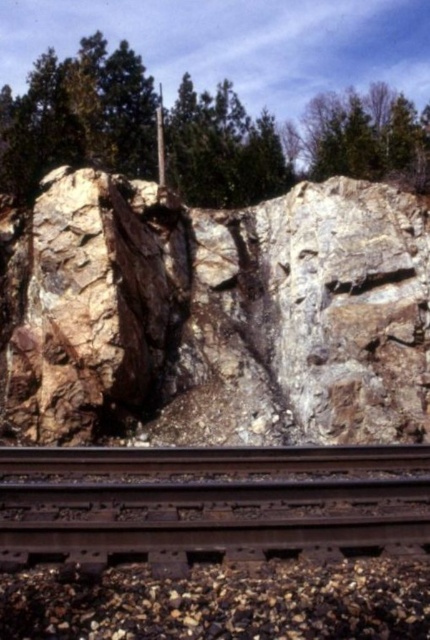
Between green rough tree at upper center and smooth wooden pole at center, which one appears on the left side from the viewer's perspective?

From the viewer's perspective, smooth wooden pole at center appears more on the left side.

Is green rough tree at upper center to the right of smooth wooden pole at center from the viewer's perspective?

Correct, you'll find green rough tree at upper center to the right of smooth wooden pole at center.

Describe the element at coordinates (288, 148) in the screenshot. The width and height of the screenshot is (430, 640). I see `green rough tree at upper center` at that location.

You are a GUI agent. You are given a task and a screenshot of the screen. Output one action in this format:
    pyautogui.click(x=<x>, y=<y>)
    Task: Click on the green rough tree at upper center
    
    Given the screenshot: What is the action you would take?
    pyautogui.click(x=288, y=148)

Between rocky cliff at center and green leafy tree at upper center, which one appears on the right side from the viewer's perspective?

green leafy tree at upper center is more to the right.

Which of these two, rocky cliff at center or green leafy tree at upper center, stands taller?

Standing taller between the two is green leafy tree at upper center.

Is point (168, 356) positioned before point (396, 93)?

Yes, point (168, 356) is in front of point (396, 93).

Image resolution: width=430 pixels, height=640 pixels. Identify the location of rocky cliff at center. click(x=218, y=316).

Between brown rusted metal train track at bottom and green leafy tree at upper center, which one appears on the right side from the viewer's perspective?

From the viewer's perspective, green leafy tree at upper center appears more on the right side.

How much distance is there between brown rusted metal train track at bottom and green leafy tree at upper center?

brown rusted metal train track at bottom and green leafy tree at upper center are 60.46 feet apart.

Does point (206, 522) lie in front of point (399, 140)?

That is True.

I want to click on brown rusted metal train track at bottom, so pyautogui.click(x=209, y=502).